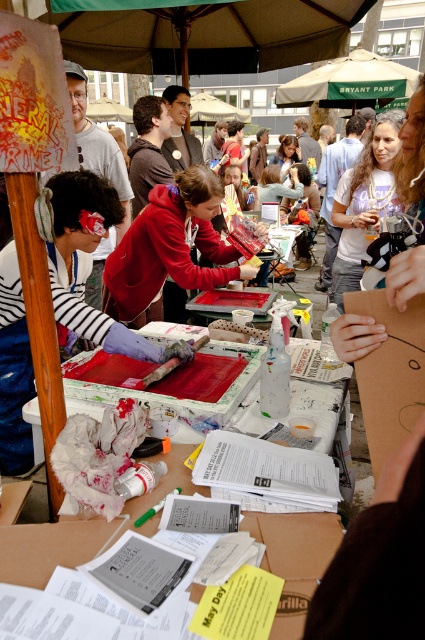
Question: Can you confirm if brown cardboard at center is wider than matte white t-shirt at center?

Choices:
 (A) no
 (B) yes

Answer: (A)

Question: Considering the relative positions of red glossy table at center and matte white t-shirt at center in the image provided, where is red glossy table at center located with respect to matte white t-shirt at center?

Choices:
 (A) above
 (B) below

Answer: (B)

Question: Which point appears closest to the camera in this image?

Choices:
 (A) (227, 276)
 (B) (34, 541)

Answer: (B)

Question: Which object appears closest to the camera in this image?

Choices:
 (A) matte white t-shirt at center
 (B) matte red hoodie at center

Answer: (B)

Question: Can you confirm if red glossy table at center is bigger than matte white t-shirt at center?

Choices:
 (A) yes
 (B) no

Answer: (B)

Question: Among these points, which one is nearest to the camera?

Choices:
 (A) (218, 205)
 (B) (291, 160)
 (C) (388, 141)
 (D) (132, 506)

Answer: (D)